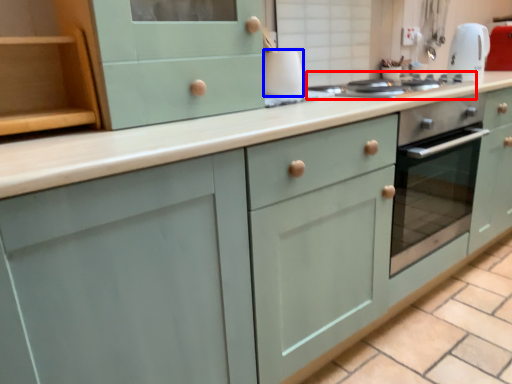
Question: Which point is closer to the camera, home appliance (highlighted by a red box) or appliance (highlighted by a blue box)?

Choices:
 (A) home appliance
 (B) appliance

Answer: (A)